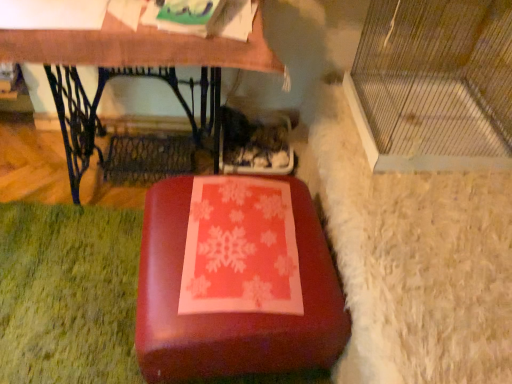
Where is `matte red suitcase at center`? The width and height of the screenshot is (512, 384). matte red suitcase at center is located at coordinates (232, 314).

What is the approximate height of clear plastic cage at right?

clear plastic cage at right is 20.12 inches tall.

What do you see at coordinates (143, 47) in the screenshot? This screenshot has width=512, height=384. I see `matte wood table at center` at bounding box center [143, 47].

The image size is (512, 384). Identify the location of matte red suitcase at center. (232, 314).

From the image's perspective, relative to clear plastic cage at right, is matte red suitcase at center above or below?

matte red suitcase at center is below clear plastic cage at right.

In the scene shown: Would you consider matte red suitcase at center to be distant from clear plastic cage at right?

Actually, matte red suitcase at center and clear plastic cage at right are a little close together.

Consider the image. Do you think matte wood table at center is within clear plastic cage at right, or outside of it?

matte wood table at center lies outside clear plastic cage at right.

Can you tell me how much matte wood table at center and clear plastic cage at right differ in facing direction?

They differ by 91.9 degrees in their facing directions.

There is a matte wood table at center. Identify the location of glass door above it (from a real-world perspective). The image size is (512, 384). (434, 85).

In the scene shown: Considering the sizes of objects clear plastic cage at right and matte red suitcase at center in the image provided, who is smaller, clear plastic cage at right or matte red suitcase at center?

Smaller between the two is matte red suitcase at center.

Is clear plastic cage at right thinner than matte red suitcase at center?

No.

Would you say clear plastic cage at right is outside matte red suitcase at center?

Absolutely, clear plastic cage at right is external to matte red suitcase at center.

How far apart are clear plastic cage at right and matte red suitcase at center?

The distance of clear plastic cage at right from matte red suitcase at center is 20.87 inches.

Which object is positioned more to the left, matte wood table at center or matte red suitcase at center?

matte wood table at center is more to the left.

Are matte wood table at center and matte red suitcase at center beside each other?

No.

Which is behind, point (169, 65) or point (161, 258)?

Point (169, 65)

From the image's perspective, between matte wood table at center and matte red suitcase at center, which one is located above?

matte wood table at center appears higher in the image.

Which object is closer to the camera, clear plastic cage at right or matte wood table at center?

clear plastic cage at right.

How distant is clear plastic cage at right from matte wood table at center?

50.77 centimeters.

From their relative heights in the image, would you say clear plastic cage at right is taller or shorter than matte wood table at center?

Clearly, clear plastic cage at right is shorter compared to matte wood table at center.

From the image's perspective, is clear plastic cage at right located beneath matte wood table at center?

No.

Is matte red suitcase at center in front of or behind matte wood table at center in the image?

matte red suitcase at center is positioned closer to the viewer than matte wood table at center.

Is matte red suitcase at center aimed at matte wood table at center?

No, matte red suitcase at center is not facing towards matte wood table at center.

The height and width of the screenshot is (384, 512). What are the coordinates of `furniture in front of the matte wood table at center` in the screenshot? It's located at (232, 314).

At what (x,y) coordinates should I click in order to perform the action: click on glass door that appears above the matte red suitcase at center (from a real-world perspective). Please return your answer as a coordinate pair (x, y). Looking at the image, I should click on (434, 85).

In order to click on glass door above the matte wood table at center (from the image's perspective) in this screenshot , I will do `click(434, 85)`.

Considering their positions, is clear plastic cage at right positioned closer to matte red suitcase at center than matte wood table at center?

Among the two, clear plastic cage at right is located nearer to matte red suitcase at center.

In the scene shown: When comparing their distances from matte red suitcase at center, does matte wood table at center or clear plastic cage at right seem closer?

clear plastic cage at right.

When comparing their distances from clear plastic cage at right, does matte wood table at center or matte red suitcase at center seem further?

The object further to clear plastic cage at right is matte red suitcase at center.

From the picture: Considering their positions, is clear plastic cage at right positioned closer to matte wood table at center than matte red suitcase at center?

clear plastic cage at right is positioned closer to the anchor matte wood table at center.

Which object lies nearer to the anchor point matte wood table at center, matte red suitcase at center or clear plastic cage at right?

clear plastic cage at right is positioned closer to the anchor matte wood table at center.

Estimate the real-world distances between objects in this image. Which object is closer to clear plastic cage at right, matte red suitcase at center or matte wood table at center?

matte wood table at center is closer to clear plastic cage at right.

The width and height of the screenshot is (512, 384). Identify the location of furniture between matte wood table at center and clear plastic cage at right. (232, 314).